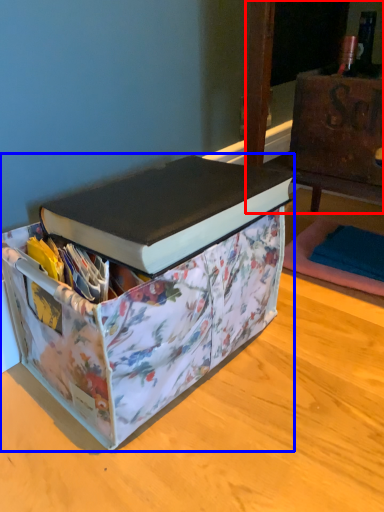
Question: Which point is further to the camera, furniture (highlighted by a red box) or box (highlighted by a blue box)?

Choices:
 (A) furniture
 (B) box

Answer: (A)